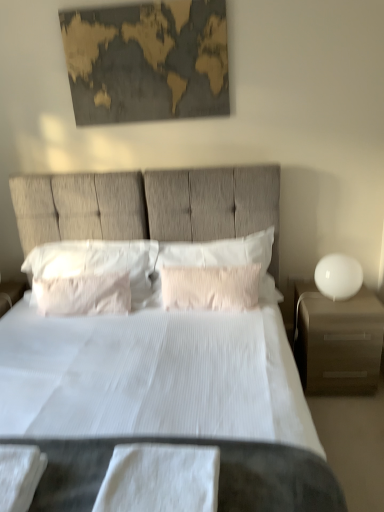
Identify the location of free space above white cotton sheet at center, the first sheet viewed from the right (from a real-world perspective). This screenshot has height=512, width=384. (174, 462).